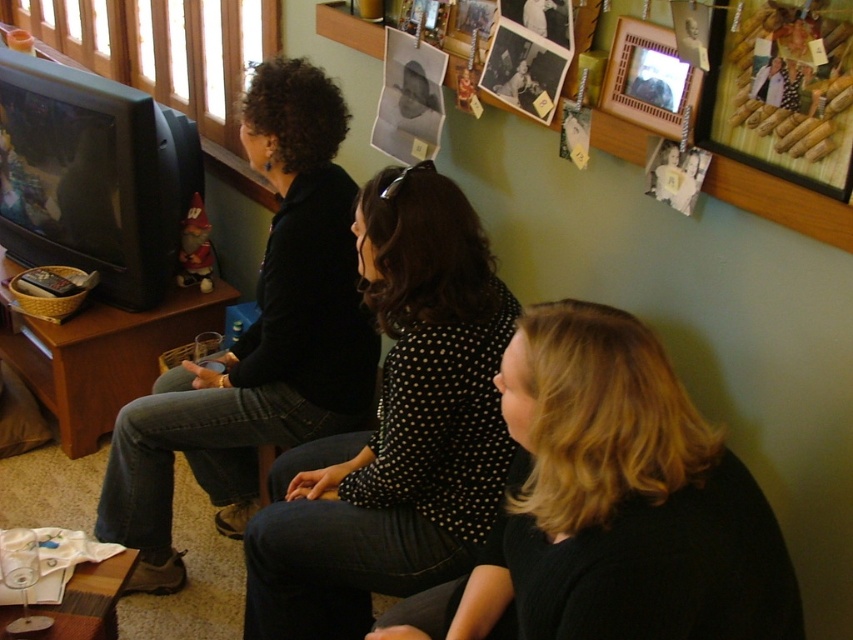
In the scene shown: Which of these two, black dotted shirt at center or wooden picture frame at upper right, stands taller?

black dotted shirt at center

Between black dotted shirt at center and wooden picture frame at upper right, which one appears on the left side from the viewer's perspective?

black dotted shirt at center is more to the left.

Is point (503, 321) positioned before point (625, 102)?

Yes.

Identify the location of black dotted shirt at center. (395, 428).

Is blonde hair at center bigger than black dotted shirt at center?

Actually, blonde hair at center might be smaller than black dotted shirt at center.

Is blonde hair at center above black dotted shirt at center?

No, blonde hair at center is not above black dotted shirt at center.

Locate an element on the screen. The image size is (853, 640). blonde hair at center is located at coordinates pos(614,504).

At what (x,y) coordinates should I click in order to perform the action: click on blonde hair at center. Please return your answer as a coordinate pair (x, y). Looking at the image, I should click on (614, 504).

Measure the distance from black dotted shirt at center to black matte shirt at left.

A distance of 16.13 inches exists between black dotted shirt at center and black matte shirt at left.

Is point (396, 573) positioned in front of point (160, 545)?

Yes, point (396, 573) is in front of point (160, 545).

In order to click on black dotted shirt at center in this screenshot , I will do `click(395, 428)`.